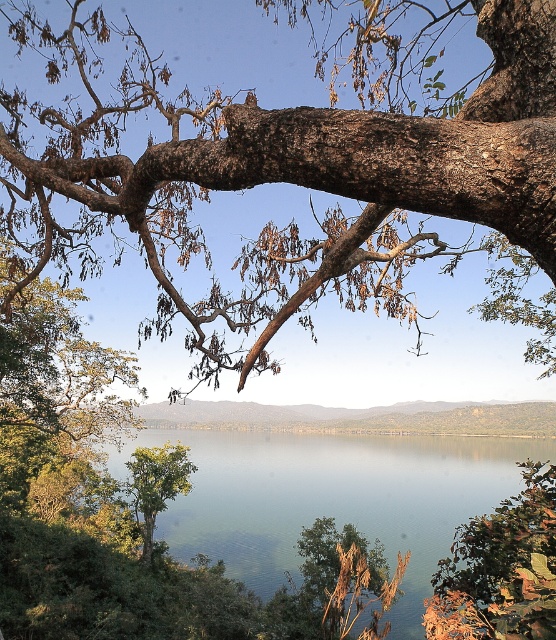
Question: Estimate the real-world distances between objects in this image. Which object is closer to the green leafy tree at center?

Choices:
 (A) clear water at center
 (B) brown rough tree branch at upper center
 (C) green matte leaves at lower right

Answer: (A)

Question: Does brown rough tree branch at upper center appear on the left side of clear water at center?

Choices:
 (A) no
 (B) yes

Answer: (A)

Question: Can you confirm if brown rough tree branch at upper center is bigger than clear water at center?

Choices:
 (A) no
 (B) yes

Answer: (B)

Question: Among these objects, which one is farthest from the camera?

Choices:
 (A) brown rough tree branch at upper center
 (B) green leafy tree at center
 (C) green matte leaves at lower right
 (D) clear water at center

Answer: (B)

Question: Does brown rough tree branch at upper center appear under green leafy tree at center?

Choices:
 (A) yes
 (B) no

Answer: (B)

Question: Which point appears farthest from the camera in this image?

Choices:
 (A) (444, 456)
 (B) (498, 282)
 (C) (534, 500)

Answer: (A)